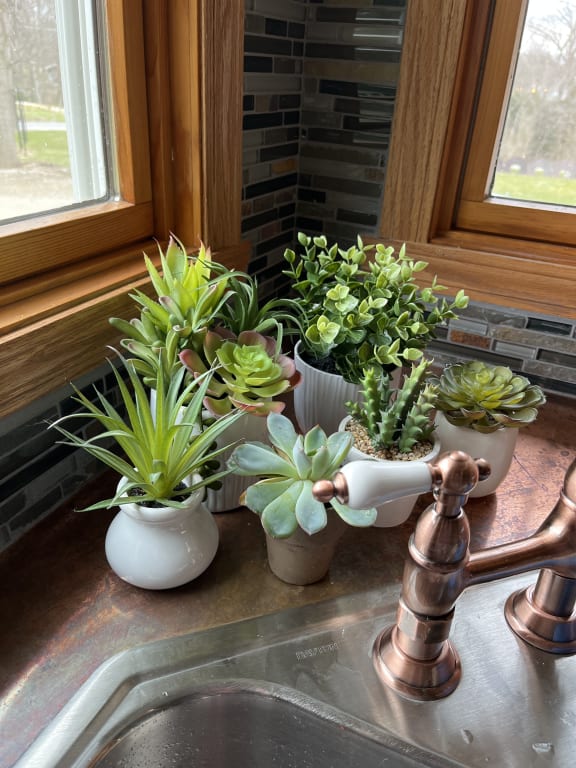
In order to click on succulent with rosy leaf tips in this screenshot , I will do `click(259, 379)`.